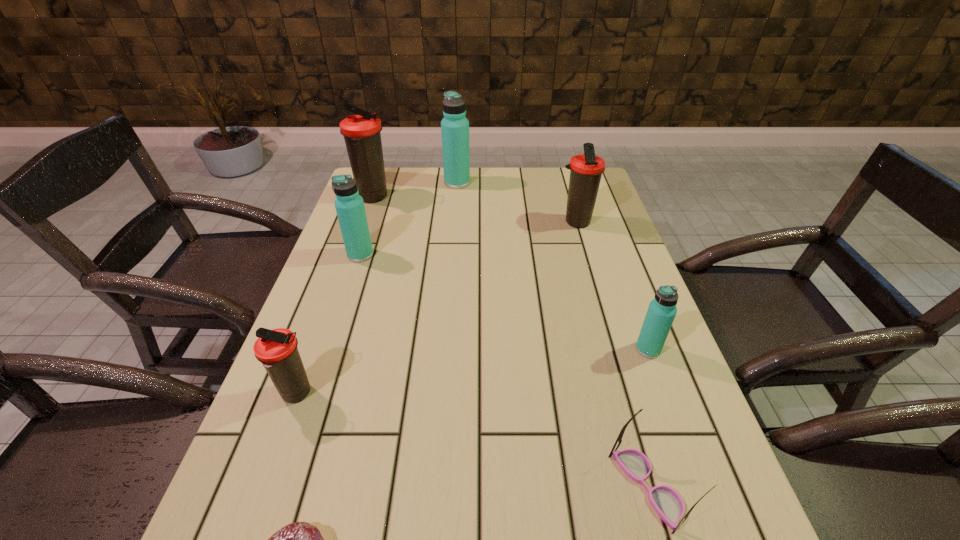
What are the coordinates of `vacant space that satisfies the following two spatial constraints: 1. on the front side of the spectacles; 2. on the left side of the third nearest object` in the screenshot? It's located at (263, 487).

You are a GUI agent. You are given a task and a screenshot of the screen. Output one action in this format:
    pyautogui.click(x=<x>, y=<y>)
    Task: Click on the vacant space that satisfies the following two spatial constraints: 1. on the back side of the third farthest thermos bottle; 2. on the right side of the pink spectacles
    This screenshot has height=540, width=960.
    Given the screenshot: What is the action you would take?
    pyautogui.click(x=573, y=222)